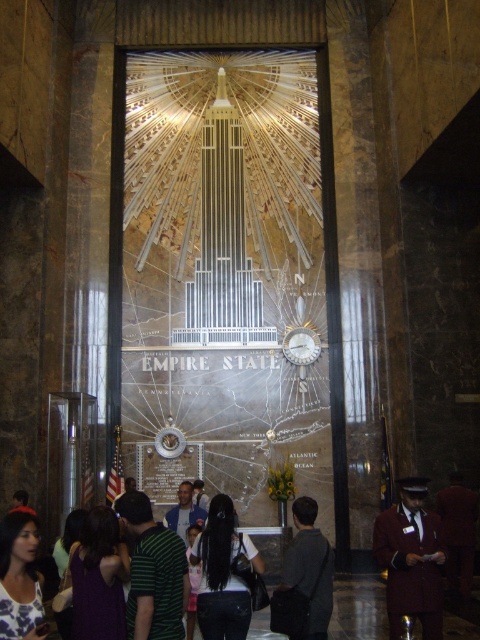
You are standing in the lobby of the Empire State Building and see the mural. You notice two points on the map section of the mural. The first point is at coordinate (x=157, y=554), and the second is at (x=0, y=545). Which point appears closer to you?

Point (x=0, y=545) is closer to you because it is positioned lower on the mural, making it appear nearer in the image.

Looking at this image, you are a photographer trying to capture a group photo of people in the lobby. You notice the green striped shirt at center and the white floral blouse at lower left. Which person should you position closer to the camera to ensure both are in focus, considering their widths?

Since the green striped shirt at center might be wider than the white floral blouse at lower left, positioning the person in the green striped shirt at center closer to the camera will help keep both in focus by reducing the depth of field difference.

You are standing in the lobby of the Empire State Building and looking at the mural. There are two points on the mural marked at coordinates point (x=376, y=528) and point (x=164, y=518). Which point appears closer to you?

Point (x=376, y=528) is closer to the camera than point (x=164, y=518), so the point at (x=376, y=528) appears closer to you.